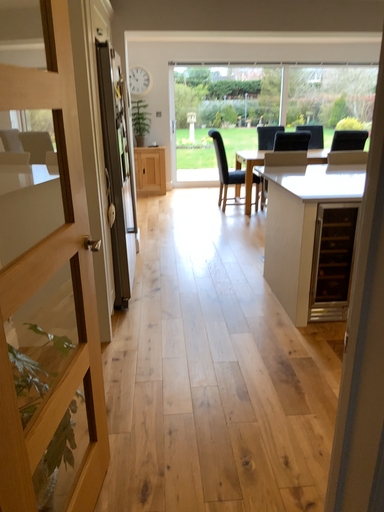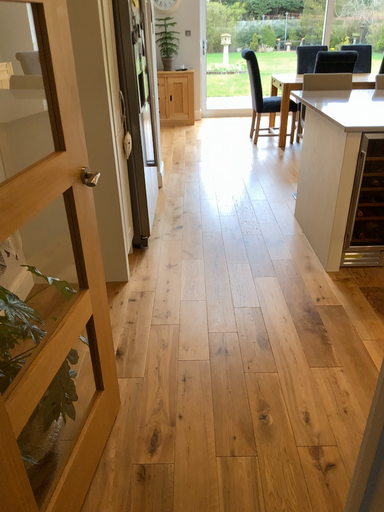
Question: How did the camera likely rotate when shooting the video?

Choices:
 (A) rotated upward
 (B) rotated downward

Answer: (B)